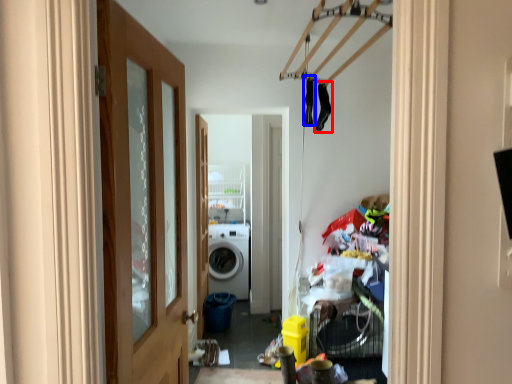
Question: Which of the following is the farthest to the observer, clothing (highlighted by a red box) or clothing (highlighted by a blue box)?

Choices:
 (A) clothing
 (B) clothing

Answer: (A)